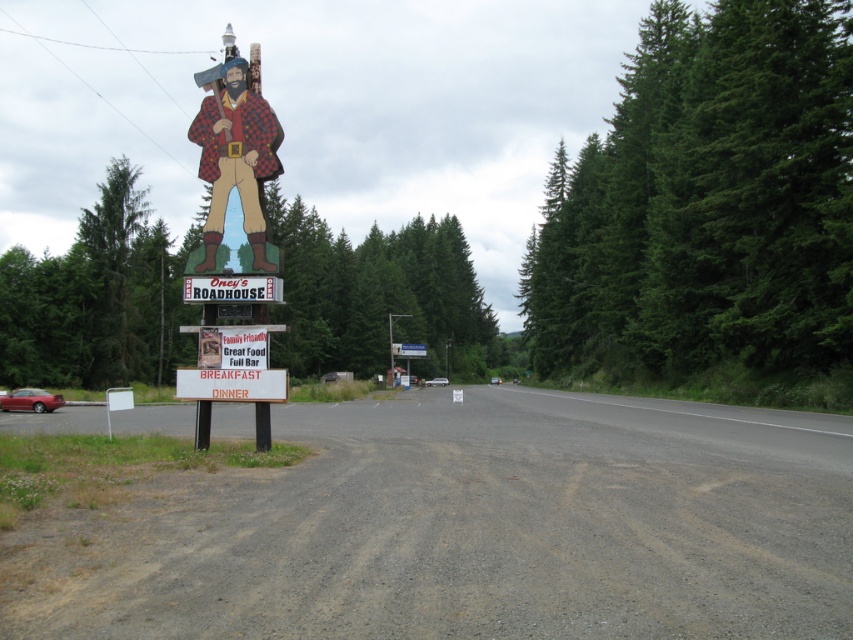
You are a truck driver passing by Oney Roadhouse. You see the matte red sign at center and the white plastic sign at center. Which sign is wider?

The white plastic sign at center is wider than the matte red sign at center.

Based on the photo, you are driving on the road and see the Oney Roadhouse sign. You need to determine the order of the objects from closest to farthest. Which object is closer to you between the wooden carved figure at center and the white plastic sign at center?

The wooden carved figure at center is closer to the viewer than the white plastic sign at center.